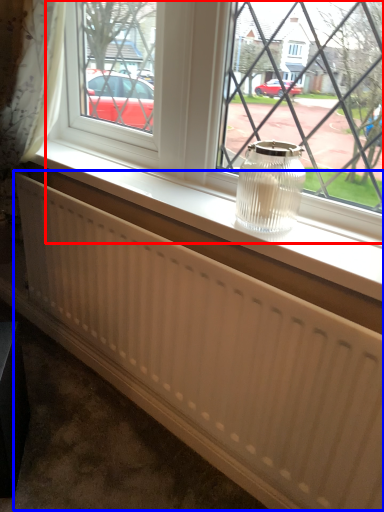
Question: Among these objects, which one is farthest to the camera, window (highlighted by a red box) or radiator (highlighted by a blue box)?

Choices:
 (A) window
 (B) radiator

Answer: (B)